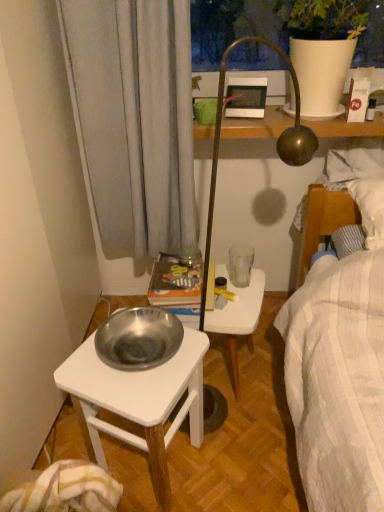
Question: Is silver metallic bowl at lower left positioned far away from white plastic stool at center?

Choices:
 (A) no
 (B) yes

Answer: (A)

Question: Is the depth of silver metallic bowl at lower left greater than that of white plastic stool at center?

Choices:
 (A) yes
 (B) no

Answer: (B)

Question: Is silver metallic bowl at lower left next to white plastic stool at center and touching it?

Choices:
 (A) no
 (B) yes

Answer: (A)

Question: Considering the relative positions of silver metallic bowl at lower left and white plastic stool at center in the image provided, is silver metallic bowl at lower left to the left of white plastic stool at center from the viewer's perspective?

Choices:
 (A) yes
 (B) no

Answer: (A)

Question: Does silver metallic bowl at lower left have a lesser height compared to white plastic stool at center?

Choices:
 (A) yes
 (B) no

Answer: (B)

Question: Based on their positions, is matte white picture frame at upper center located to the left or right of silver metallic bowl at lower left?

Choices:
 (A) left
 (B) right

Answer: (B)

Question: Considering the positions of matte white picture frame at upper center and silver metallic bowl at lower left in the image, is matte white picture frame at upper center taller or shorter than silver metallic bowl at lower left?

Choices:
 (A) short
 (B) tall

Answer: (A)

Question: From a real-world perspective, is matte white picture frame at upper center positioned above or below silver metallic bowl at lower left?

Choices:
 (A) below
 (B) above

Answer: (B)

Question: Considering the positions of matte white picture frame at upper center and silver metallic bowl at lower left in the image, is matte white picture frame at upper center wider or thinner than silver metallic bowl at lower left?

Choices:
 (A) wide
 (B) thin

Answer: (B)

Question: Considering the positions of matte white picture frame at upper center and white plastic stool at center in the image, is matte white picture frame at upper center taller or shorter than white plastic stool at center?

Choices:
 (A) short
 (B) tall

Answer: (A)

Question: From a real-world perspective, is matte white picture frame at upper center positioned above or below white plastic stool at center?

Choices:
 (A) above
 (B) below

Answer: (A)

Question: Is point (261, 95) closer or farther from the camera than point (238, 389)?

Choices:
 (A) closer
 (B) farther

Answer: (A)

Question: Looking at their shapes, would you say matte white picture frame at upper center is wider or thinner than white plastic stool at center?

Choices:
 (A) wide
 (B) thin

Answer: (B)

Question: Looking at the image, does silver metallic bowl at lower left seem bigger or smaller compared to white plastic stool at center?

Choices:
 (A) small
 (B) big

Answer: (B)

Question: Is silver metallic bowl at lower left taller or shorter than white plastic stool at center?

Choices:
 (A) tall
 (B) short

Answer: (A)